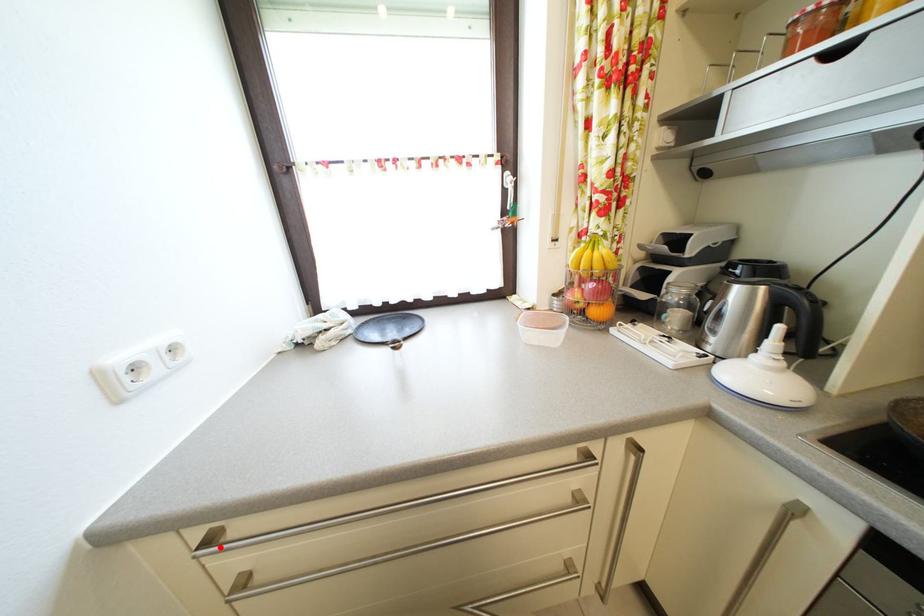
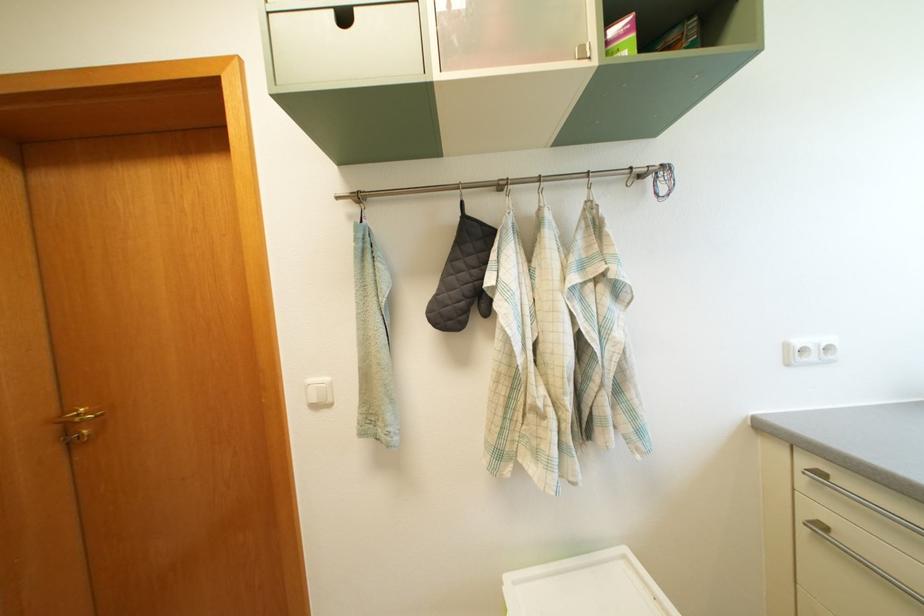
Where in the second image is the point corresponding to the highlighted location from the first image?

(827, 480)